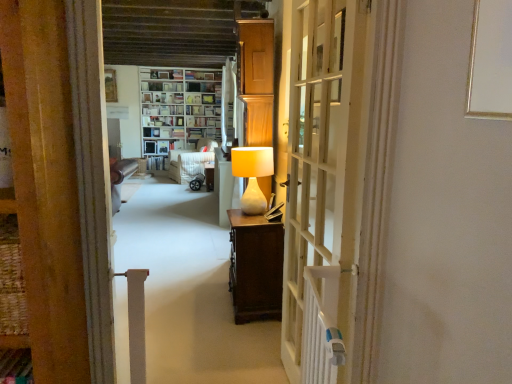
I want to click on white wooden bookshelf at center, so click(x=178, y=110).

The height and width of the screenshot is (384, 512). I want to click on white fabric armchair at center, so click(191, 161).

Where is `white wooden door at center`? white wooden door at center is located at coordinates (322, 184).

Where is `white sheer curtain at upper center`? white sheer curtain at upper center is located at coordinates (228, 104).

Is white sheer curtain at upper center far away from wooden picture frame at upper center?

Yes, white sheer curtain at upper center and wooden picture frame at upper center are located far from each other.

Which object is further away from the camera taking this photo, white sheer curtain at upper center or wooden picture frame at upper center?

Positioned behind is wooden picture frame at upper center.

In terms of size, does white sheer curtain at upper center appear bigger or smaller than wooden picture frame at upper center?

In the image, white sheer curtain at upper center appears to be larger than wooden picture frame at upper center.

Does point (229, 109) come closer to viewer compared to point (109, 74)?

Yes, it is in front of point (109, 74).

Does point (117, 95) appear closer or farther from the camera than point (192, 108)?

Point (117, 95) is farther from the camera than point (192, 108).

Is there a large distance between wooden picture frame at upper center and white wooden bookshelf at center?

No, wooden picture frame at upper center is in close proximity to white wooden bookshelf at center.

Would you say white wooden bookshelf at center is part of wooden picture frame at upper center's contents?

No, white wooden bookshelf at center is not a part of wooden picture frame at upper center.

Considering the relative sizes of wooden picture frame at upper center and white wooden bookshelf at center in the image provided, is wooden picture frame at upper center bigger than white wooden bookshelf at center?

No.

Is matte white lamp at center next to white wooden door at center and touching it?

No, matte white lamp at center is not touching white wooden door at center.

Does matte white lamp at center have a smaller size compared to white wooden door at center?

Yes, matte white lamp at center is smaller than white wooden door at center.

Considering the sizes of matte white lamp at center and white wooden door at center in the image, is matte white lamp at center wider or thinner than white wooden door at center?

In the image, matte white lamp at center appears to be wider than white wooden door at center.

Can you tell me how much matte white lamp at center and white wooden door at center differ in facing direction?

matte white lamp at center and white wooden door at center are facing 1.56 degrees away from each other.

Is white wooden bookshelf at center shorter than wooden picture frame at upper center?

No, white wooden bookshelf at center is not shorter than wooden picture frame at upper center.

Does point (141, 109) appear closer or farther from the camera than point (111, 88)?

Clearly, point (141, 109) is more distant from the camera than point (111, 88).

Looking at this image, is white wooden bookshelf at center at the right side of wooden picture frame at upper center?

Indeed, white wooden bookshelf at center is positioned on the right side of wooden picture frame at upper center.

Does white wooden bookshelf at center have a larger size compared to wooden picture frame at upper center?

Correct, white wooden bookshelf at center is larger in size than wooden picture frame at upper center.

In the scene shown: Considering the relative sizes of wooden picture frame at upper center and white fabric armchair at center in the image provided, is wooden picture frame at upper center smaller than white fabric armchair at center?

Yes.

From a real-world perspective, is wooden picture frame at upper center above or below white fabric armchair at center?

wooden picture frame at upper center is above white fabric armchair at center.

Considering the sizes of wooden picture frame at upper center and white fabric armchair at center in the image, is wooden picture frame at upper center taller or shorter than white fabric armchair at center?

Clearly, wooden picture frame at upper center is shorter compared to white fabric armchair at center.

Is point (106, 74) farther from viewer compared to point (180, 165)?

No, (106, 74) is in front of (180, 165).

Who is taller, wooden picture frame at upper center or white wooden door at center?

With more height is white wooden door at center.

In the scene shown: Considering the sizes of wooden picture frame at upper center and white wooden door at center in the image, is wooden picture frame at upper center wider or thinner than white wooden door at center?

In the image, wooden picture frame at upper center appears to be more narrow than white wooden door at center.

From the image's perspective, between wooden picture frame at upper center and white wooden door at center, which one is located above?

wooden picture frame at upper center appears higher in the image.

Can you confirm if wooden picture frame at upper center is bigger than white wooden door at center?

Actually, wooden picture frame at upper center might be smaller than white wooden door at center.

Is matte white lamp at center not close to white fabric armchair at center?

Yes, matte white lamp at center is far from white fabric armchair at center.

Considering the points (246, 211) and (191, 175), which point is behind, point (246, 211) or point (191, 175)?

The point (191, 175) is farther from the camera.

Is white fabric armchair at center completely or partially inside matte white lamp at center?

No, white fabric armchair at center is located outside of matte white lamp at center.

In the image, there is a wooden picture frame at upper center. Where is `curtain below it (from the image's perspective)`? The image size is (512, 384). curtain below it (from the image's perspective) is located at coordinates (228, 104).

Locate an element on the screen. The image size is (512, 384). shelf on the right of the wooden picture frame at upper center is located at coordinates (178, 110).

Estimate the real-world distances between objects in this image. Which object is further from white sheer curtain at upper center, matte white lamp at center or white wooden door at center?

Among the two, white wooden door at center is located further to white sheer curtain at upper center.

When comparing their distances from white wooden bookshelf at center, does wooden picture frame at upper center or matte white lamp at center seem closer?

Based on the image, wooden picture frame at upper center appears to be nearer to white wooden bookshelf at center.

Estimate the real-world distances between objects in this image. Which object is closer to white wooden bookshelf at center, white wooden door at center or white sheer curtain at upper center?

white sheer curtain at upper center lies closer to white wooden bookshelf at center than the other object.

Which object lies further to the anchor point white fabric armchair at center, white sheer curtain at upper center or wooden picture frame at upper center?

Based on the image, wooden picture frame at upper center appears to be further to white fabric armchair at center.

Looking at the image, which one is located closer to white sheer curtain at upper center, wooden picture frame at upper center or white wooden bookshelf at center?

white wooden bookshelf at center is closer to white sheer curtain at upper center.

From the image, which object appears to be farther from white wooden door at center, white fabric armchair at center or wooden picture frame at upper center?

wooden picture frame at upper center lies further to white wooden door at center than the other object.

Based on their spatial positions, is white fabric armchair at center or matte white lamp at center closer to white wooden bookshelf at center?

Based on the image, white fabric armchair at center appears to be nearer to white wooden bookshelf at center.

Considering their positions, is white fabric armchair at center positioned closer to white sheer curtain at upper center than white wooden bookshelf at center?

white fabric armchair at center is positioned closer to the anchor white sheer curtain at upper center.

Find the location of a particular element. The image size is (512, 384). curtain positioned between matte white lamp at center and wooden picture frame at upper center from near to far is located at coordinates (228, 104).

This screenshot has width=512, height=384. Find the location of `curtain between matte white lamp at center and white wooden bookshelf at center along the z-axis`. curtain between matte white lamp at center and white wooden bookshelf at center along the z-axis is located at coordinates (228, 104).

At what (x,y) coordinates should I click in order to perform the action: click on curtain between matte white lamp at center and white fabric armchair at center from front to back. Please return your answer as a coordinate pair (x, y). Looking at the image, I should click on (228, 104).

Where is `table lamp between white wooden door at center and white wooden bookshelf at center from front to back`? table lamp between white wooden door at center and white wooden bookshelf at center from front to back is located at coordinates pos(252,175).